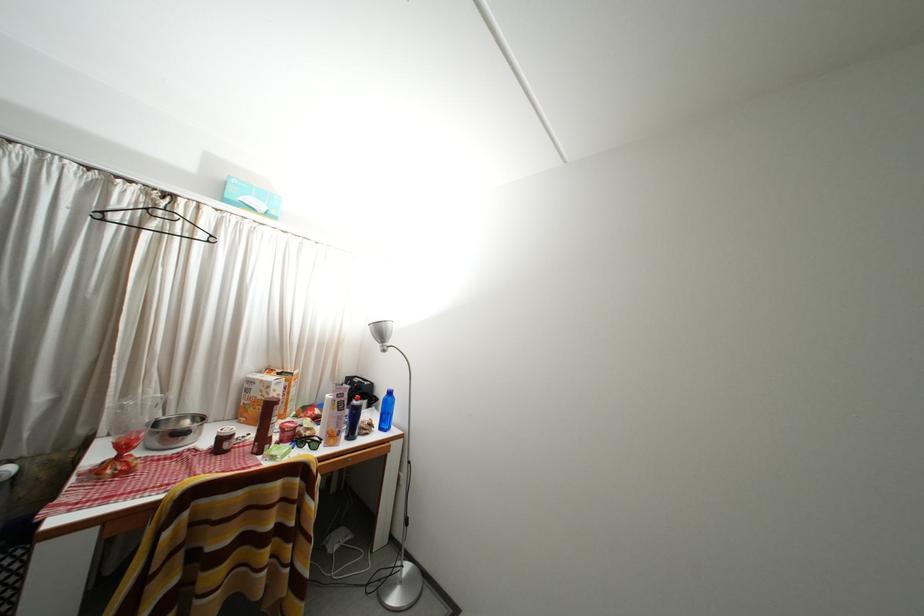
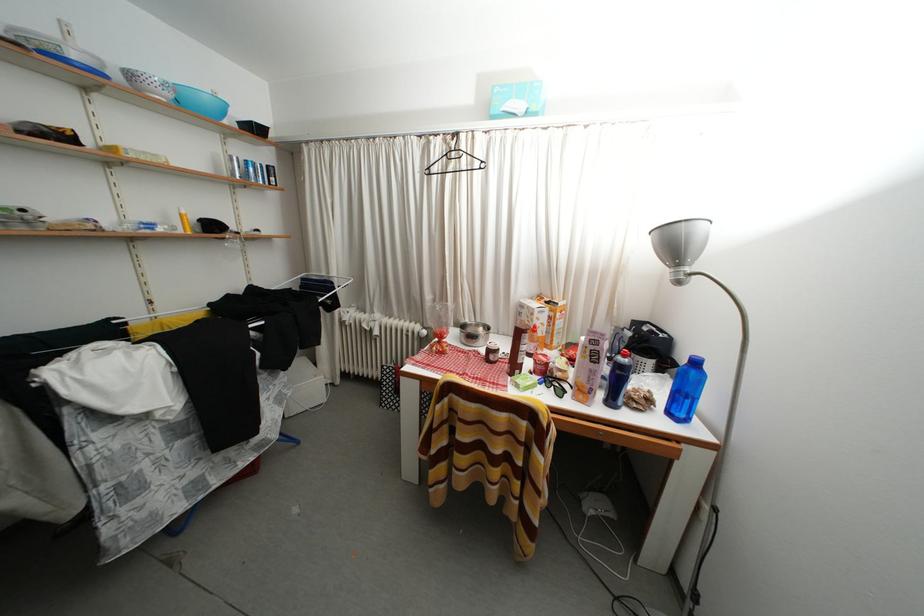
Find the pixel in the second image that matches (x=359, y=442) in the first image.

(618, 408)